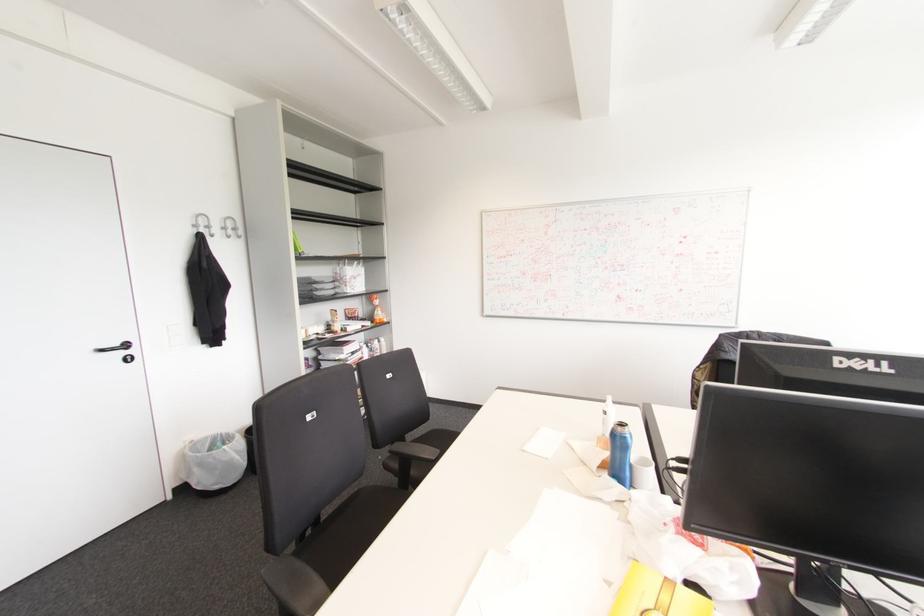
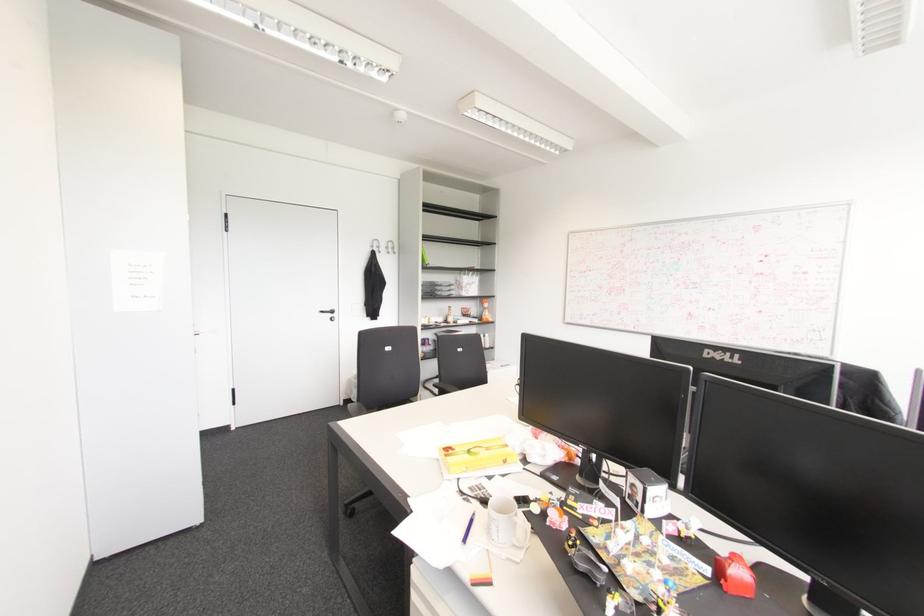
Where in the second image is the point corresponding to (x=195, y=225) from the first image?

(371, 246)